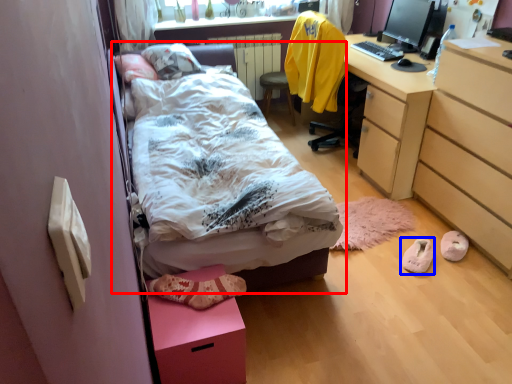
Question: Which of the following is the farthest to the observer, bed (highlighted by a red box) or footwear (highlighted by a blue box)?

Choices:
 (A) bed
 (B) footwear

Answer: (B)